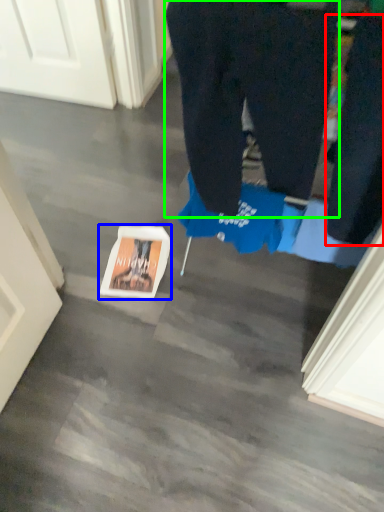
Question: Based on their relative distances, which object is farther from pants (highlighted by a red box)? Choose from copy (highlighted by a blue box) and trousers (highlighted by a green box).

Choices:
 (A) copy
 (B) trousers

Answer: (A)